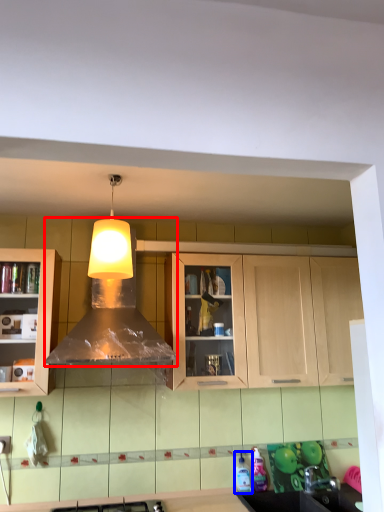
Question: Among these objects, which one is farthest to the camera, hood (highlighted by a red box) or bottle (highlighted by a blue box)?

Choices:
 (A) hood
 (B) bottle

Answer: (B)